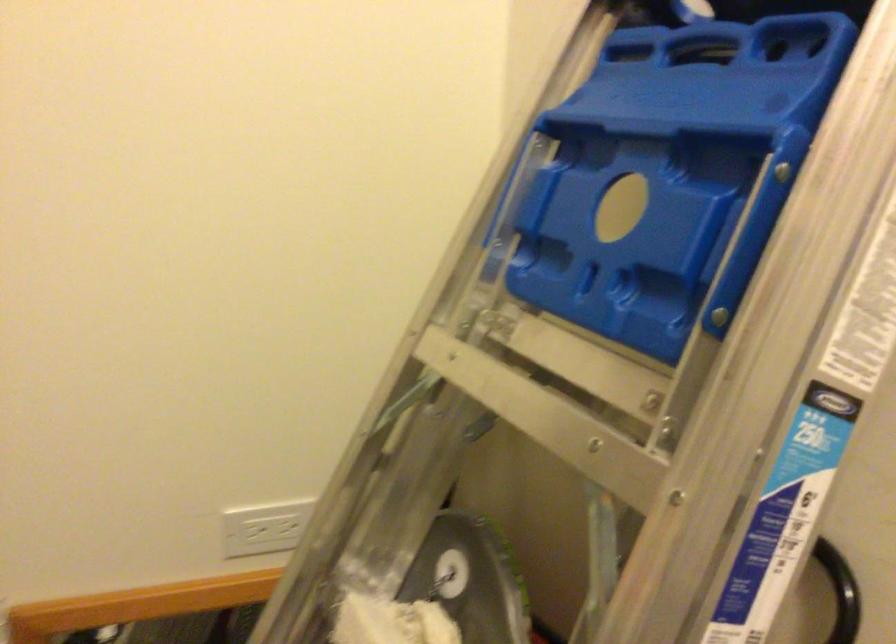
How did the camera likely rotate?

The camera's rotation is toward right-down.